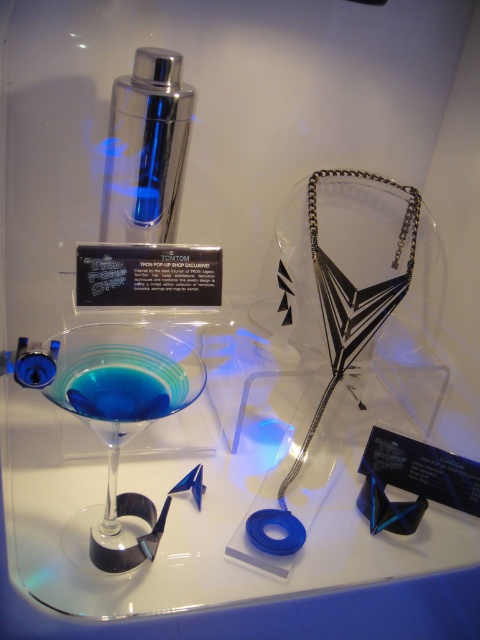
Is shiny metallic cocktail shaker at upper left below blue translucent liquid at lower left?

Actually, shiny metallic cocktail shaker at upper left is above blue translucent liquid at lower left.

Can you confirm if shiny metallic cocktail shaker at upper left is wider than blue translucent liquid at lower left?

Yes, shiny metallic cocktail shaker at upper left is wider than blue translucent liquid at lower left.

Locate an element on the screen. shiny metallic cocktail shaker at upper left is located at coordinates (145, 148).

Locate an element on the screen. Image resolution: width=480 pixels, height=640 pixels. shiny metallic cocktail shaker at upper left is located at coordinates (145, 148).

Who is lower down, transparent glass martini glass at center or blue translucent liquid at lower left?

transparent glass martini glass at center

I want to click on transparent glass martini glass at center, so [x=123, y=416].

I want to click on transparent glass martini glass at center, so click(x=123, y=416).

Who is more distant from viewer, (177,342) or (162,54)?

Point (162,54)

Is transparent glass martini glass at center positioned behind shiny metallic cocktail shaker at upper left?

No, it is in front of shiny metallic cocktail shaker at upper left.

Is point (168, 506) farther from viewer compared to point (177, 54)?

No.

This screenshot has width=480, height=640. I want to click on transparent glass martini glass at center, so click(123, 416).